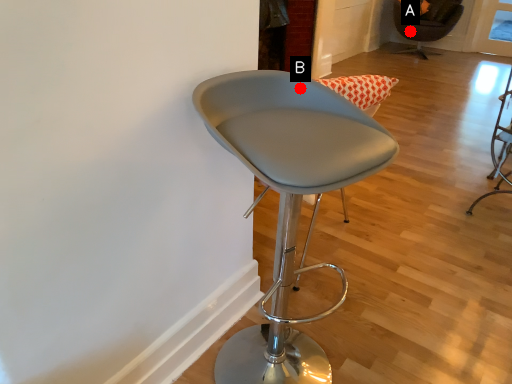
Question: Two points are circled on the image, labeled by A and B beside each circle. Among these points, which one is farthest from the camera?

Choices:
 (A) A is further
 (B) B is further

Answer: (A)